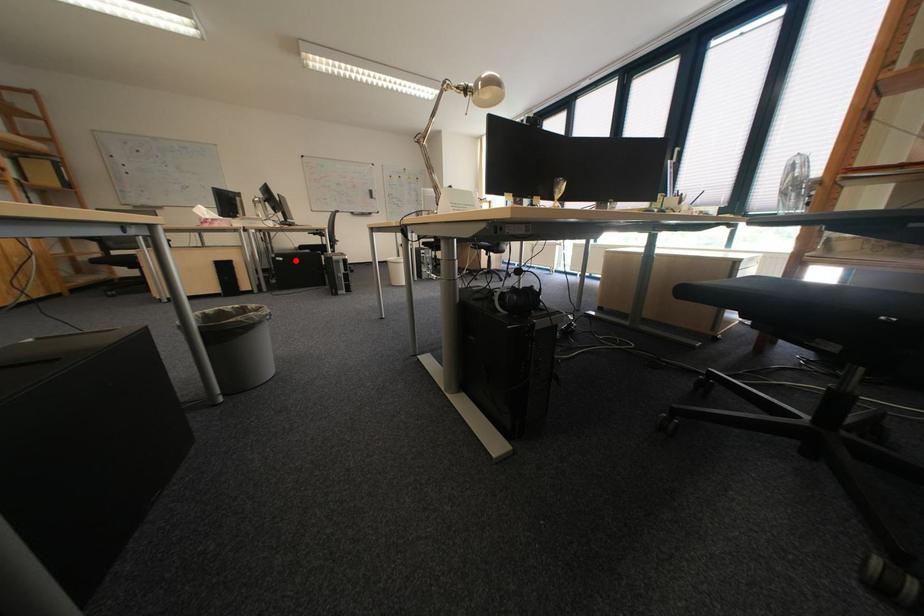
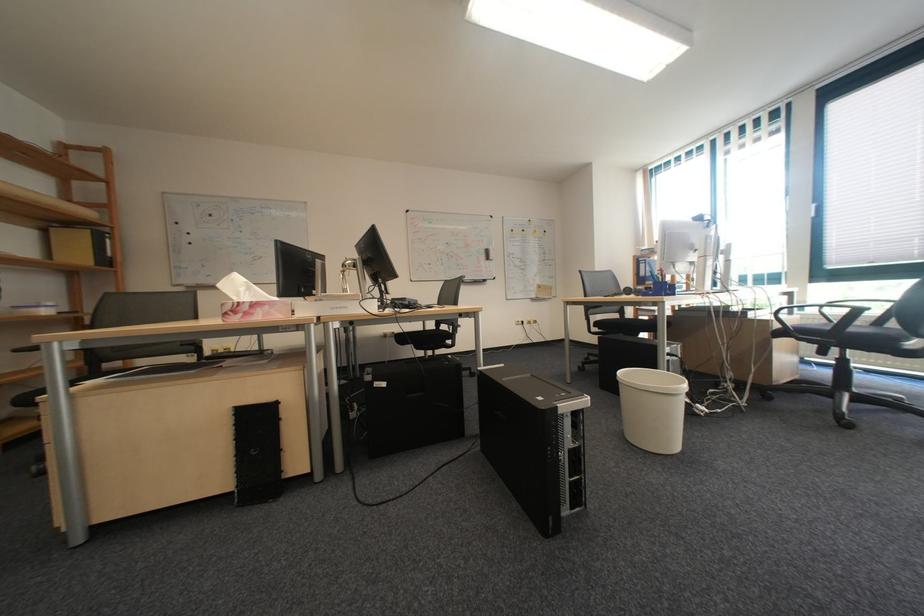
Where in the second image is the point corresponding to the highlighted location from the first image?

(398, 386)